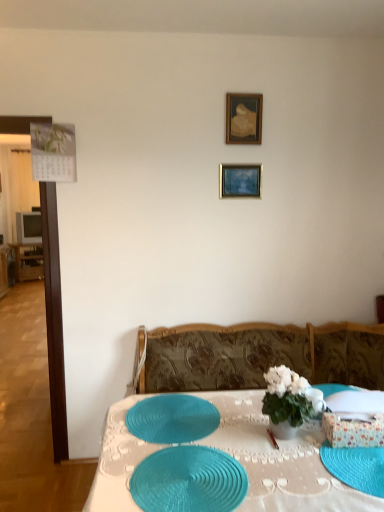
Identify the location of teal woven placemat at center, the 1th tableware viewed from the back. (172, 419).

The image size is (384, 512). What do you see at coordinates (188, 481) in the screenshot? I see `teal woven placemat at center, positioned as the second tableware in back-to-front order` at bounding box center [188, 481].

Describe the element at coordinates (240, 180) in the screenshot. I see `gold metallic picture frame at upper center, the 2th picture frame in the top-to-bottom sequence` at that location.

You are a GUI agent. You are given a task and a screenshot of the screen. Output one action in this format:
    pyautogui.click(x=<x>, y=<y>)
    Task: Click on the white glossy vase at center
    
    Given the screenshot: What is the action you would take?
    pyautogui.click(x=288, y=401)

What do you see at coordinates (288, 401) in the screenshot?
I see `white glossy vase at center` at bounding box center [288, 401].

Describe the element at coordinates (356, 467) in the screenshot. I see `blue textured glass plate at lower right` at that location.

Locate an element on the screen. This screenshot has height=512, width=384. matte gray television at left is located at coordinates (29, 227).

From the image's perspective, which is above, gold metallic picture frame at upper center, the 2th picture frame in the top-to-bottom sequence, or wooden picture frame at upper center, the 2th picture frame in the bottom-to-top sequence?

wooden picture frame at upper center, the 2th picture frame in the bottom-to-top sequence, appears higher in the image.

In terms of height, does gold metallic picture frame at upper center, acting as the first picture frame starting from the bottom, look taller or shorter compared to wooden picture frame at upper center, the 2th picture frame in the bottom-to-top sequence?

Clearly, gold metallic picture frame at upper center, acting as the first picture frame starting from the bottom, is shorter compared to wooden picture frame at upper center, the 2th picture frame in the bottom-to-top sequence.

From the picture: Which point is more distant from viewer, (229, 177) or (235, 138)?

The point (229, 177) is farther.

Is blue textured glass plate at lower right not near gold metallic picture frame at upper center, acting as the first picture frame starting from the bottom?

Yes, blue textured glass plate at lower right and gold metallic picture frame at upper center, acting as the first picture frame starting from the bottom, are located far from each other.

From a real-world perspective, between blue textured glass plate at lower right and gold metallic picture frame at upper center, the 2th picture frame in the top-to-bottom sequence, who is vertically higher?

gold metallic picture frame at upper center, the 2th picture frame in the top-to-bottom sequence.

Considering the sizes of objects blue textured glass plate at lower right and gold metallic picture frame at upper center, the 2th picture frame in the top-to-bottom sequence, in the image provided, who is bigger, blue textured glass plate at lower right or gold metallic picture frame at upper center, the 2th picture frame in the top-to-bottom sequence,?

blue textured glass plate at lower right is bigger.

How different are the orientations of blue textured glass plate at lower right and gold metallic picture frame at upper center, the 2th picture frame in the top-to-bottom sequence, in degrees?

The facing directions of blue textured glass plate at lower right and gold metallic picture frame at upper center, the 2th picture frame in the top-to-bottom sequence, are 89.3 degrees apart.

The height and width of the screenshot is (512, 384). I want to click on houseplant that appears above the teal woven placemat at center, positioned as the second tableware in back-to-front order (from the image's perspective), so click(288, 401).

Is teal woven placemat at center, the first tableware in the front-to-back sequence, spatially inside white glossy vase at center, or outside of it?

teal woven placemat at center, the first tableware in the front-to-back sequence, is located beyond the bounds of white glossy vase at center.

Looking at this image, considering the positions of objects teal woven placemat at center, positioned as the second tableware in back-to-front order, and white glossy vase at center in the image provided, who is behind, teal woven placemat at center, positioned as the second tableware in back-to-front order, or white glossy vase at center?

white glossy vase at center is further from the camera.

Looking at the image, does teal woven placemat at center, positioned as the second tableware in back-to-front order, seem bigger or smaller compared to white glossy vase at center?

Considering their sizes, teal woven placemat at center, positioned as the second tableware in back-to-front order, takes up less space than white glossy vase at center.

Is matte gray television at left outside of wooden picture frame at upper center, the 2th picture frame in the bottom-to-top sequence?

Yes, matte gray television at left is not within wooden picture frame at upper center, the 2th picture frame in the bottom-to-top sequence.

Which point is more forward, (40,239) or (230,141)?

The point (230,141) is closer to the camera.

From a real-world perspective, is matte gray television at left on top of wooden picture frame at upper center, the 2th picture frame in the bottom-to-top sequence?

No, from a real-world perspective, matte gray television at left is not on top of wooden picture frame at upper center, the 2th picture frame in the bottom-to-top sequence.

Can you see matte gray television at left touching wooden picture frame at upper center, which ranks as the first picture frame in top-to-bottom order?

There is a gap between matte gray television at left and wooden picture frame at upper center, which ranks as the first picture frame in top-to-bottom order.

Is point (186, 404) more distant than point (40, 237)?

No, (186, 404) is closer to viewer.

Based on the photo, is the position of teal woven placemat at center, the 1th tableware viewed from the back, more distant than that of matte gray television at left?

No, teal woven placemat at center, the 1th tableware viewed from the back, is closer to the viewer.

From the picture: Is teal woven placemat at center, the 1th tableware viewed from the back, facing away from matte gray television at left?

teal woven placemat at center, the 1th tableware viewed from the back, is not turned away from matte gray television at left.

Considering the sizes of objects teal woven placemat at center, which ranks as the 2th tableware in front-to-back order, and matte gray television at left in the image provided, who is wider, teal woven placemat at center, which ranks as the 2th tableware in front-to-back order, or matte gray television at left?

teal woven placemat at center, which ranks as the 2th tableware in front-to-back order.

From a real-world perspective, which is physically above, teal woven placemat at center, positioned as the second tableware in back-to-front order, or teal woven placemat at center, which ranks as the 2th tableware in front-to-back order?

teal woven placemat at center, which ranks as the 2th tableware in front-to-back order, is physically above.

Is teal woven placemat at center, positioned as the second tableware in back-to-front order, oriented towards teal woven placemat at center, which ranks as the 2th tableware in front-to-back order?

No.

Is teal woven placemat at center, which ranks as the 2th tableware in front-to-back order, located within teal woven placemat at center, the first tableware in the front-to-back sequence?

That's incorrect, teal woven placemat at center, which ranks as the 2th tableware in front-to-back order, is not inside teal woven placemat at center, the first tableware in the front-to-back sequence.

Does point (177, 503) come in front of point (173, 442)?

Yes, it is.

From the image's perspective, is teal woven placemat at center, positioned as the second tableware in back-to-front order, on top of gold metallic picture frame at upper center, acting as the first picture frame starting from the bottom?

Actually, teal woven placemat at center, positioned as the second tableware in back-to-front order, appears below gold metallic picture frame at upper center, acting as the first picture frame starting from the bottom, in the image.

From a real-world perspective, is teal woven placemat at center, the first tableware in the front-to-back sequence, on gold metallic picture frame at upper center, the 2th picture frame in the top-to-bottom sequence?

No, from a real-world perspective, teal woven placemat at center, the first tableware in the front-to-back sequence, is not on top of gold metallic picture frame at upper center, the 2th picture frame in the top-to-bottom sequence.

Which of these two, teal woven placemat at center, the first tableware in the front-to-back sequence, or gold metallic picture frame at upper center, acting as the first picture frame starting from the bottom, is bigger?

Bigger between the two is teal woven placemat at center, the first tableware in the front-to-back sequence.

Is teal woven placemat at center, positioned as the second tableware in back-to-front order, facing towards gold metallic picture frame at upper center, acting as the first picture frame starting from the bottom?

No, teal woven placemat at center, positioned as the second tableware in back-to-front order, does not turn towards gold metallic picture frame at upper center, acting as the first picture frame starting from the bottom.

Image resolution: width=384 pixels, height=512 pixels. I want to click on picture frame that is below the wooden picture frame at upper center, which ranks as the first picture frame in top-to-bottom order (from the image's perspective), so (x=240, y=180).

This screenshot has height=512, width=384. I want to click on picture frame that is the 1st object above the blue textured glass plate at lower right (from a real-world perspective), so click(240, 180).

Looking at the image, which one is located further to teal woven placemat at center, white glossy vase at center or matte gray television at left?

The object further to teal woven placemat at center is matte gray television at left.

From the image, which object appears to be farther from teal woven placemat at center, white glossy vase at center or wooden picture frame at upper center, which ranks as the first picture frame in top-to-bottom order?

wooden picture frame at upper center, which ranks as the first picture frame in top-to-bottom order.

From the image, which object appears to be farther from teal woven placemat at center, the 1th tableware viewed from the back, matte gray television at left or blue textured glass plate at lower right?

Among the two, matte gray television at left is located further to teal woven placemat at center, the 1th tableware viewed from the back.

From the image, which object appears to be farther from teal woven placemat at center, positioned as the second tableware in back-to-front order, matte gray television at left or blue textured glass plate at lower right?

Based on the image, matte gray television at left appears to be further to teal woven placemat at center, positioned as the second tableware in back-to-front order.

Looking at the image, which one is located closer to matte gray television at left, wooden picture frame at upper center, which ranks as the first picture frame in top-to-bottom order, or teal woven placemat at center?

Among the two, wooden picture frame at upper center, which ranks as the first picture frame in top-to-bottom order, is located nearer to matte gray television at left.

Looking at the image, which one is located further to blue textured glass plate at lower right, gold metallic picture frame at upper center, acting as the first picture frame starting from the bottom, or teal woven placemat at center, the first tableware in the front-to-back sequence?

Based on the image, gold metallic picture frame at upper center, acting as the first picture frame starting from the bottom, appears to be further to blue textured glass plate at lower right.

Which object lies nearer to the anchor point matte gray television at left, teal woven placemat at center, positioned as the second tableware in back-to-front order, or blue textured glass plate at lower right?

Based on the image, teal woven placemat at center, positioned as the second tableware in back-to-front order, appears to be nearer to matte gray television at left.

Which object lies further to the anchor point matte gray television at left, teal woven placemat at center, the 1th tableware viewed from the back, or white glossy vase at center?

white glossy vase at center is further to matte gray television at left.

Locate an element on the screen. picture frame between wooden picture frame at upper center, which ranks as the first picture frame in top-to-bottom order, and teal woven placemat at center, which ranks as the 2th tableware in front-to-back order, from top to bottom is located at coordinates (240, 180).

In order to click on glass plate between wooden picture frame at upper center, the 2th picture frame in the bottom-to-top sequence, and teal woven placemat at center in the up-down direction in this screenshot , I will do `click(356, 467)`.

Identify the location of picture frame between wooden picture frame at upper center, which ranks as the first picture frame in top-to-bottom order, and teal woven placemat at center, positioned as the second tableware in back-to-front order, in the up-down direction. (240, 180).

Find the location of a particular element. The width and height of the screenshot is (384, 512). tableware between wooden picture frame at upper center, the 2th picture frame in the bottom-to-top sequence, and blue textured glass plate at lower right from top to bottom is located at coordinates (172, 419).